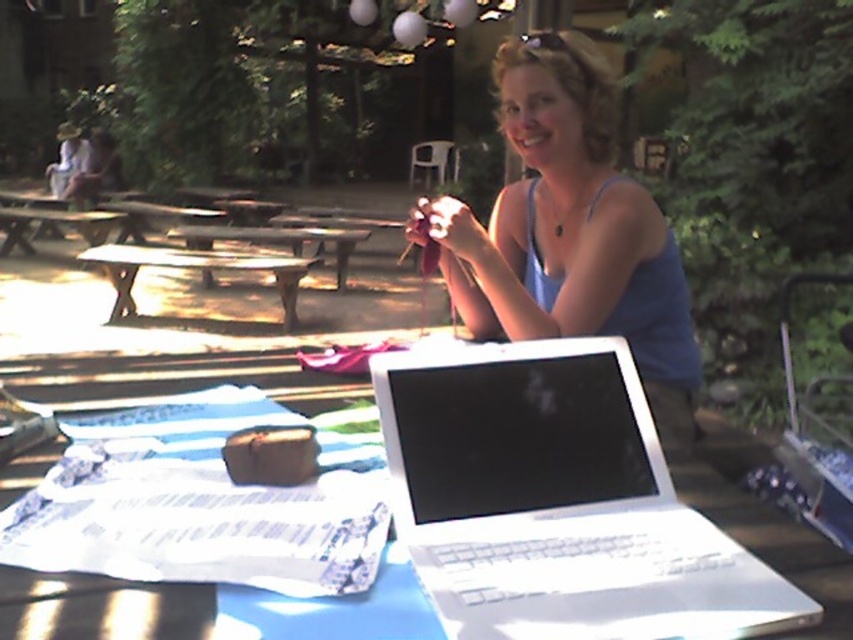
Is white plastic table at center smaller than wooden picnic table at center?

Yes, white plastic table at center is smaller than wooden picnic table at center.

Measure the distance between white plastic table at center and wooden picnic table at center.

white plastic table at center is 3.81 meters from wooden picnic table at center.

At what (x,y) coordinates should I click in order to perform the action: click on white plastic table at center. Please return your answer as a coordinate pair (x, y). This screenshot has height=640, width=853. Looking at the image, I should click on (207, 609).

Identify the location of white plastic table at center. (207, 609).

Between point (454, 404) and point (193, 214), which one is positioned in front?

Point (454, 404)

Between white plastic laptop at center and wooden picnic table at center, which one has more height?

With more height is wooden picnic table at center.

At what (x,y) coordinates should I click in order to perform the action: click on white plastic laptop at center. Please return your answer as a coordinate pair (x, y). This screenshot has height=640, width=853. Looking at the image, I should click on click(x=556, y=500).

Does blue fabric tank top at center have a lesser height compared to white plastic table at center?

No, blue fabric tank top at center is not shorter than white plastic table at center.

Who is positioned more to the right, blue fabric tank top at center or white plastic table at center?

blue fabric tank top at center is more to the right.

At what (x,y) coordinates should I click in order to perform the action: click on blue fabric tank top at center. Please return your answer as a coordinate pair (x, y). The width and height of the screenshot is (853, 640). Looking at the image, I should click on (570, 228).